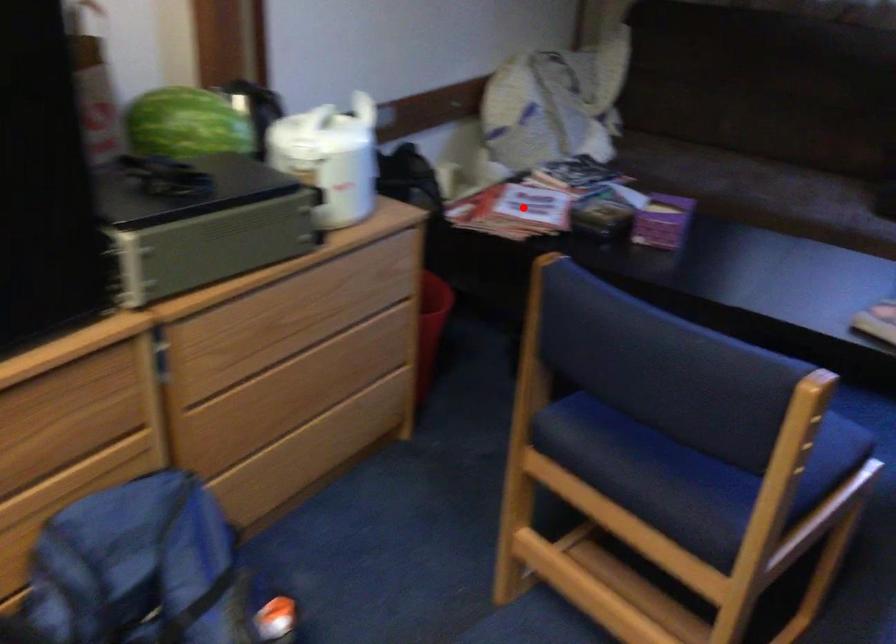
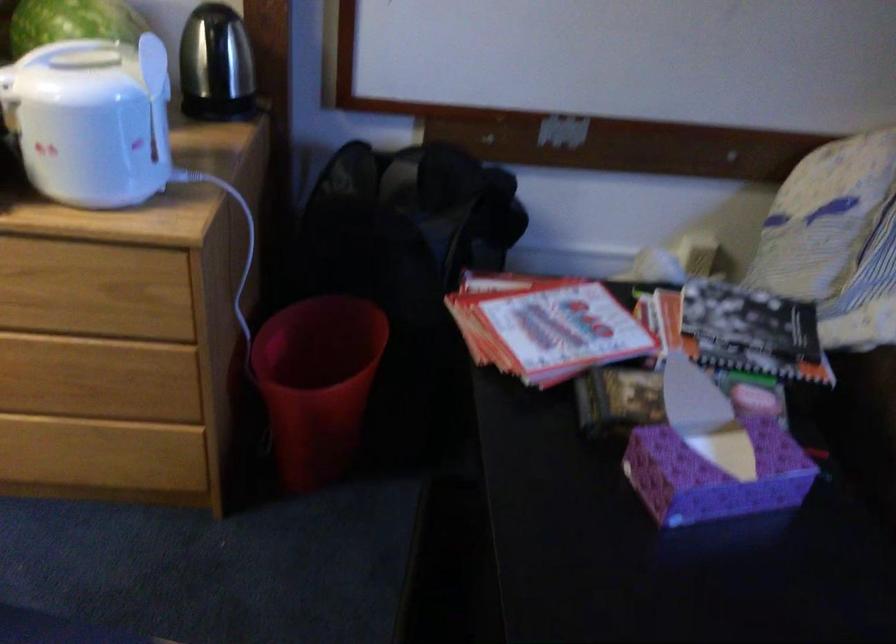
Find the pixel in the second image that matches the highlighted location in the first image.

(545, 326)